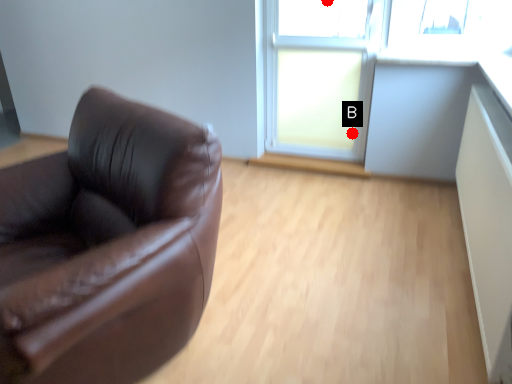
Question: Two points are circled on the image, labeled by A and B beside each circle. Which point is farther from the camera taking this photo?

Choices:
 (A) A is further
 (B) B is further

Answer: (A)